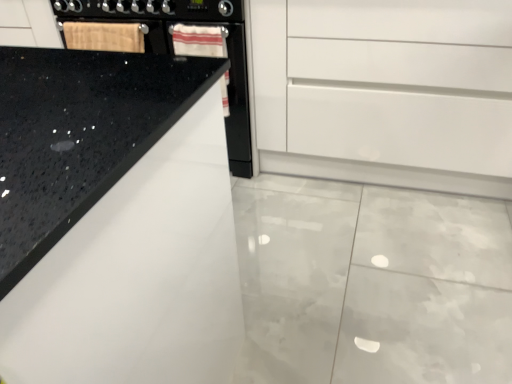
Question: Is black granite countertop at upper left facing away from wooden cutting board at upper left?

Choices:
 (A) yes
 (B) no

Answer: (A)

Question: Is black granite countertop at upper left further to camera compared to wooden cutting board at upper left?

Choices:
 (A) no
 (B) yes

Answer: (A)

Question: From a real-world perspective, does black granite countertop at upper left stand above wooden cutting board at upper left?

Choices:
 (A) no
 (B) yes

Answer: (A)

Question: Are black granite countertop at upper left and wooden cutting board at upper left far apart?

Choices:
 (A) yes
 (B) no

Answer: (A)

Question: Can you confirm if black granite countertop at upper left is smaller than wooden cutting board at upper left?

Choices:
 (A) no
 (B) yes

Answer: (A)

Question: Is white glossy cabinet at center inside or outside of wooden cutting board at upper left?

Choices:
 (A) outside
 (B) inside

Answer: (A)

Question: Considering the positions of white glossy cabinet at center and wooden cutting board at upper left in the image, is white glossy cabinet at center taller or shorter than wooden cutting board at upper left?

Choices:
 (A) short
 (B) tall

Answer: (B)

Question: From the image's perspective, is white glossy cabinet at center located above or below wooden cutting board at upper left?

Choices:
 (A) above
 (B) below

Answer: (B)

Question: Considering the positions of white glossy cabinet at center and wooden cutting board at upper left in the image, is white glossy cabinet at center bigger or smaller than wooden cutting board at upper left?

Choices:
 (A) small
 (B) big

Answer: (B)

Question: Is black granite countertop at upper left bigger or smaller than white glossy cabinet at center?

Choices:
 (A) small
 (B) big

Answer: (B)

Question: From a real-world perspective, is black granite countertop at upper left positioned above or below white glossy cabinet at center?

Choices:
 (A) above
 (B) below

Answer: (A)

Question: From the image's perspective, is black granite countertop at upper left positioned above or below white glossy cabinet at center?

Choices:
 (A) above
 (B) below

Answer: (B)

Question: Based on their positions, is black granite countertop at upper left located to the left or right of white glossy cabinet at center?

Choices:
 (A) left
 (B) right

Answer: (A)

Question: From the image's perspective, is white glossy cabinet at center positioned above or below black granite countertop at upper left?

Choices:
 (A) below
 (B) above

Answer: (B)

Question: Is white glossy cabinet at center situated inside black granite countertop at upper left or outside?

Choices:
 (A) outside
 (B) inside

Answer: (A)